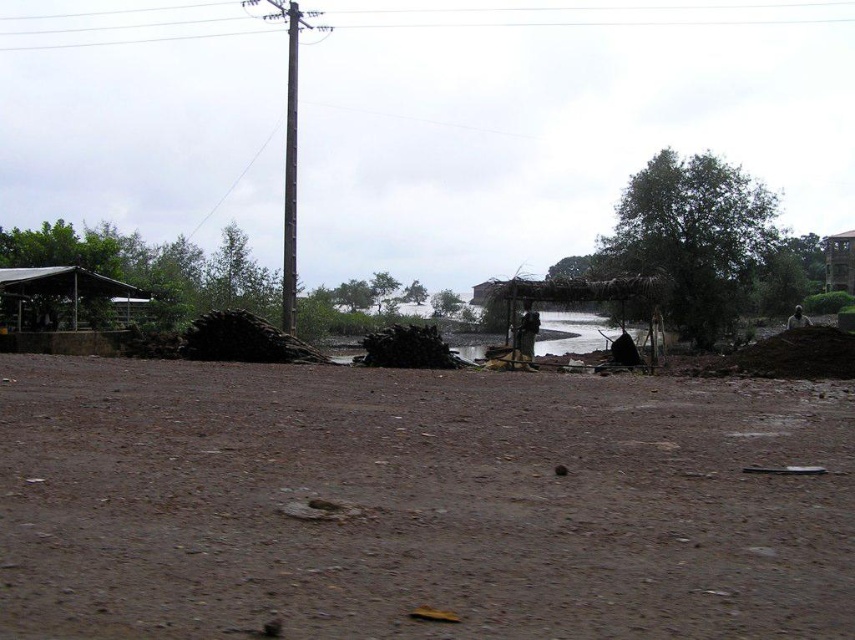
Who is shorter, brown mud at center or smooth gray pole at center?

With less height is brown mud at center.

Who is more distant from viewer, (x=535, y=349) or (x=287, y=152)?

The point (x=535, y=349) is behind.

At what (x,y) coordinates should I click in order to perform the action: click on brown mud at center. Please return your answer as a coordinate pair (x, y). This screenshot has height=640, width=855. Looking at the image, I should click on (573, 333).

Between dull brown dirt at center and smooth gray pole at center, which one appears on the left side from the viewer's perspective?

smooth gray pole at center

Can you confirm if dull brown dirt at center is wider than smooth gray pole at center?

No.

Locate an element on the screen. This screenshot has width=855, height=640. dull brown dirt at center is located at coordinates (417, 502).

Where is `dull brown dirt at center`? The height and width of the screenshot is (640, 855). dull brown dirt at center is located at coordinates 417,502.

Is point (556, 486) farther from camera compared to point (841, 289)?

No, (556, 486) is closer to viewer.

Is dull brown dirt at center to the left of wooden thatched hut at right from the viewer's perspective?

Yes, dull brown dirt at center is to the left of wooden thatched hut at right.

Does point (178, 470) come in front of point (844, 285)?

Yes.

The width and height of the screenshot is (855, 640). I want to click on dull brown dirt at center, so click(x=417, y=502).